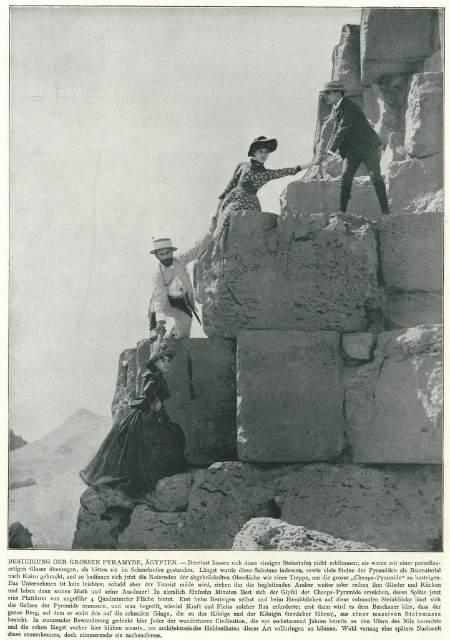
Question: From the image, what is the correct spatial relationship of light brown leather hat at upper center in relation to dotted fabric dress at center?

Choices:
 (A) below
 (B) above

Answer: (B)

Question: Does light brown leather hat at upper center have a larger size compared to white matte hat at center?

Choices:
 (A) yes
 (B) no

Answer: (A)

Question: Does matte black dress at lower left have a lesser width compared to light brown leather hat at upper center?

Choices:
 (A) no
 (B) yes

Answer: (A)

Question: Among these points, which one is nearest to the camera?

Choices:
 (A) (178, 264)
 (B) (251, 173)
 (C) (383, 180)
 (D) (175, 460)

Answer: (D)

Question: Which object is positioned closest to the white matte hat at center?

Choices:
 (A) light brown leather hat at upper center
 (B) matte black dress at lower left
 (C) dotted fabric dress at center

Answer: (C)

Question: Based on their relative distances, which object is nearer to the light brown leather hat at upper center?

Choices:
 (A) matte black dress at lower left
 (B) white matte hat at center

Answer: (B)